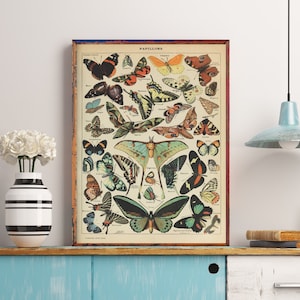
This screenshot has height=300, width=300. In order to click on stacked books in this screenshot , I will do `click(274, 238)`.